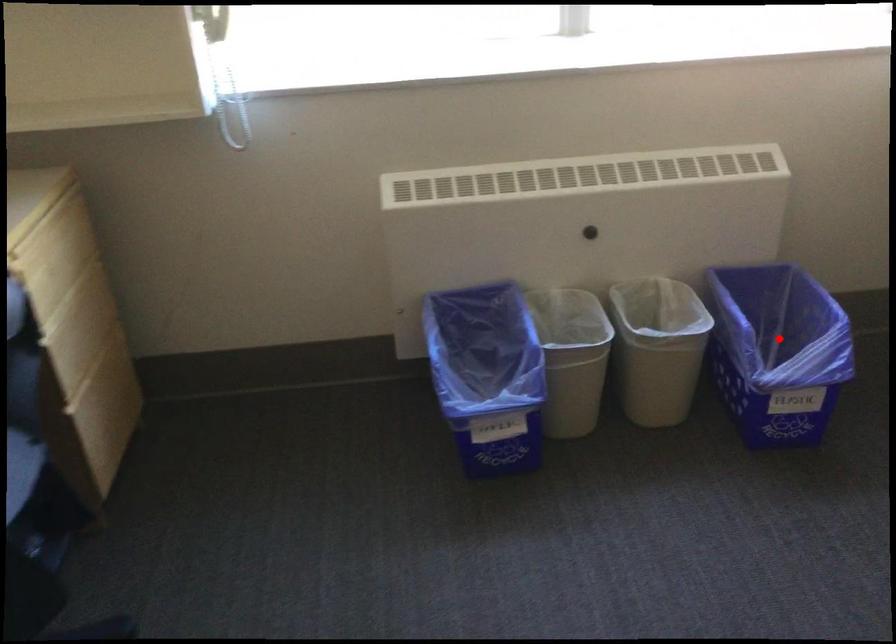
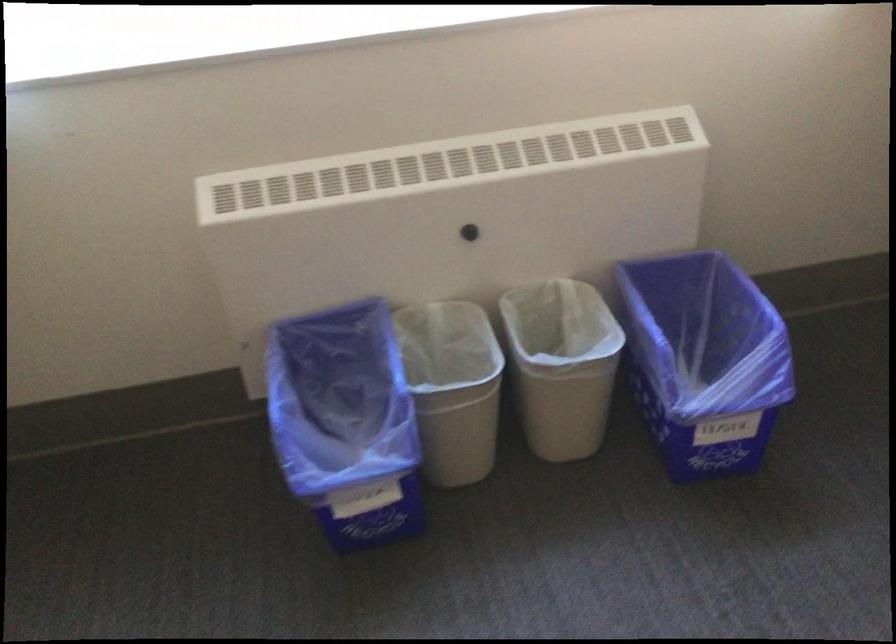
Locate, in the second image, the point that corresponds to the highlighted location in the first image.

(702, 339)